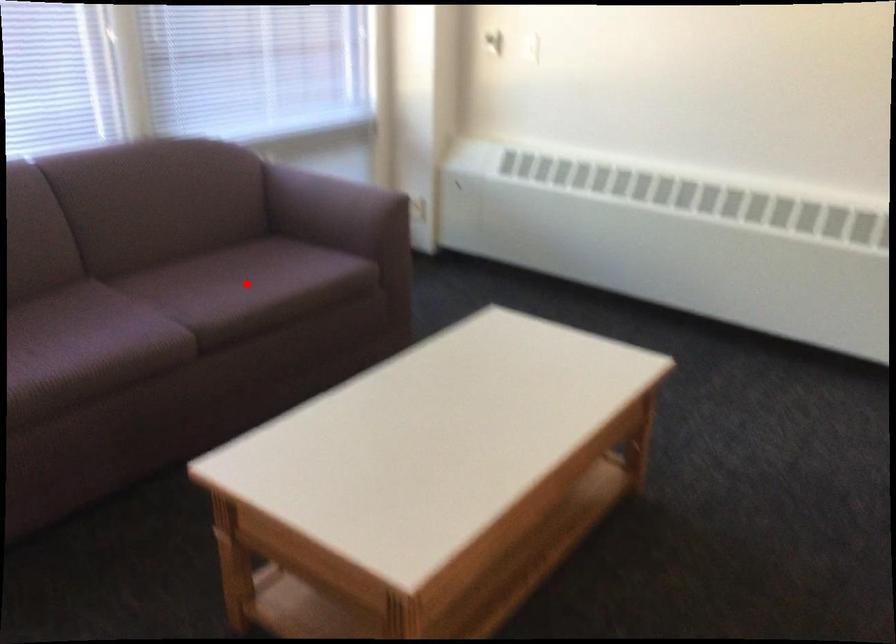
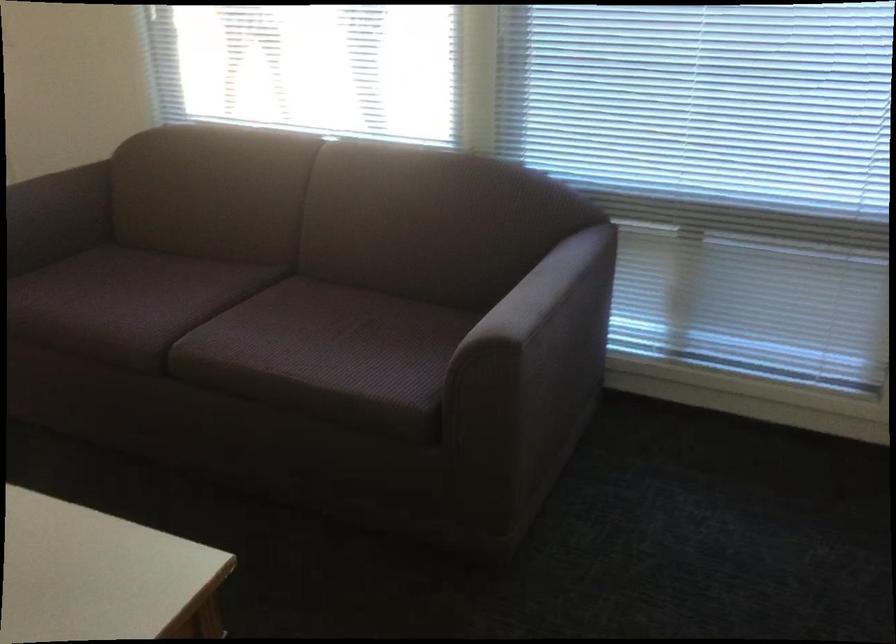
In the second image, find the point that corresponds to the highlighted location in the first image.

(325, 346)